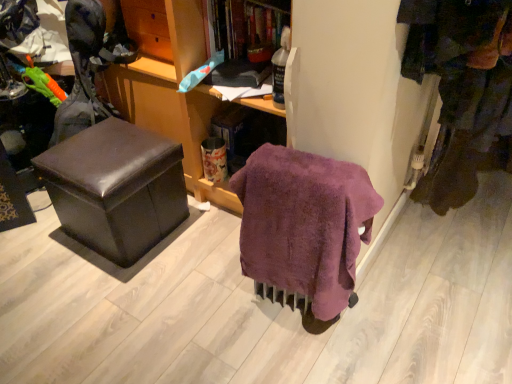
Question: Does dark brown fabric pants at right have a greater width compared to wooden cabinet at center?

Choices:
 (A) no
 (B) yes

Answer: (A)

Question: Is dark brown fabric pants at right bigger than wooden cabinet at center?

Choices:
 (A) no
 (B) yes

Answer: (A)

Question: Is the depth of dark brown fabric pants at right less than that of wooden cabinet at center?

Choices:
 (A) yes
 (B) no

Answer: (B)

Question: Does dark brown fabric pants at right contain wooden cabinet at center?

Choices:
 (A) yes
 (B) no

Answer: (B)

Question: Can you confirm if dark brown fabric pants at right is positioned to the left of wooden cabinet at center?

Choices:
 (A) no
 (B) yes

Answer: (A)

Question: Is dark brown fabric pants at right inside or outside of wooden cabinet at center?

Choices:
 (A) outside
 (B) inside

Answer: (A)

Question: In terms of width, does dark brown fabric pants at right look wider or thinner when compared to wooden cabinet at center?

Choices:
 (A) thin
 (B) wide

Answer: (A)

Question: Would you say dark brown fabric pants at right is to the left or to the right of wooden cabinet at center in the picture?

Choices:
 (A) right
 (B) left

Answer: (A)

Question: From the image's perspective, is dark brown fabric pants at right located above or below wooden cabinet at center?

Choices:
 (A) above
 (B) below

Answer: (B)

Question: Looking at the image, does shiny brown ottoman at left seem bigger or smaller compared to wooden bookshelf at upper center, positioned as the 2th shelf in left-to-right order?

Choices:
 (A) small
 (B) big

Answer: (B)

Question: Visually, is shiny brown ottoman at left positioned to the left or to the right of wooden bookshelf at upper center, the 1th shelf when ordered from right to left?

Choices:
 (A) left
 (B) right

Answer: (A)

Question: From a real-world perspective, is shiny brown ottoman at left positioned above or below wooden bookshelf at upper center, positioned as the 2th shelf in left-to-right order?

Choices:
 (A) below
 (B) above

Answer: (A)

Question: Considering the positions of shiny brown ottoman at left and wooden bookshelf at upper center, the 1th shelf when ordered from right to left, in the image, is shiny brown ottoman at left taller or shorter than wooden bookshelf at upper center, the 1th shelf when ordered from right to left,?

Choices:
 (A) tall
 (B) short

Answer: (A)

Question: From the image's perspective, relative to wooden shelf at upper center, positioned as the 2th shelf in right-to-left order, is dark brown fabric pants at right above or below?

Choices:
 (A) above
 (B) below

Answer: (B)

Question: Considering the positions of dark brown fabric pants at right and wooden shelf at upper center, which ranks as the first shelf in left-to-right order, in the image, is dark brown fabric pants at right wider or thinner than wooden shelf at upper center, which ranks as the first shelf in left-to-right order,?

Choices:
 (A) wide
 (B) thin

Answer: (B)